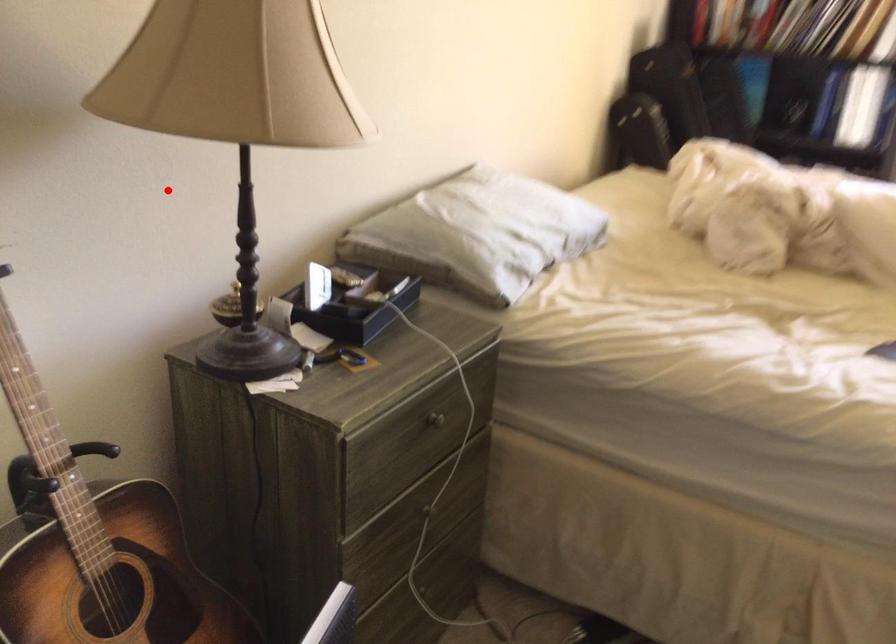
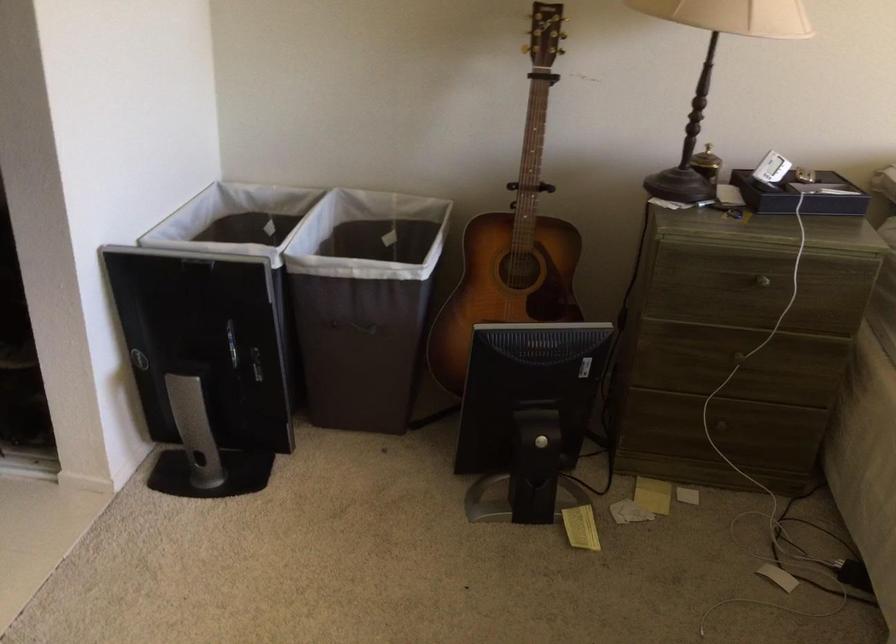
Question: I am providing you with two images of the same scene from different viewpoints. Given a red point in image1, look at the same physical point in image2. Is it:

Choices:
 (A) Closer to the viewpoint
 (B) Farther from the viewpoint

Answer: (B)